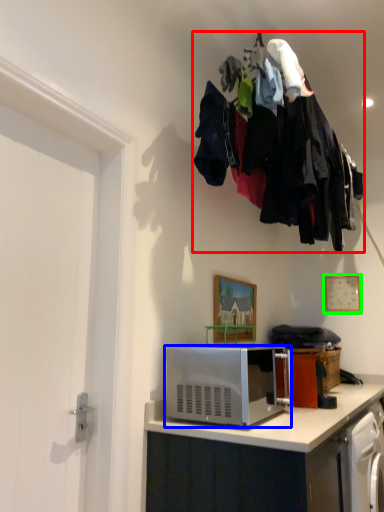
Question: Which is nearer to the laundry (highlighted by a red box)? microwave oven (highlighted by a blue box) or picture frame (highlighted by a green box).

Choices:
 (A) microwave oven
 (B) picture frame

Answer: (A)